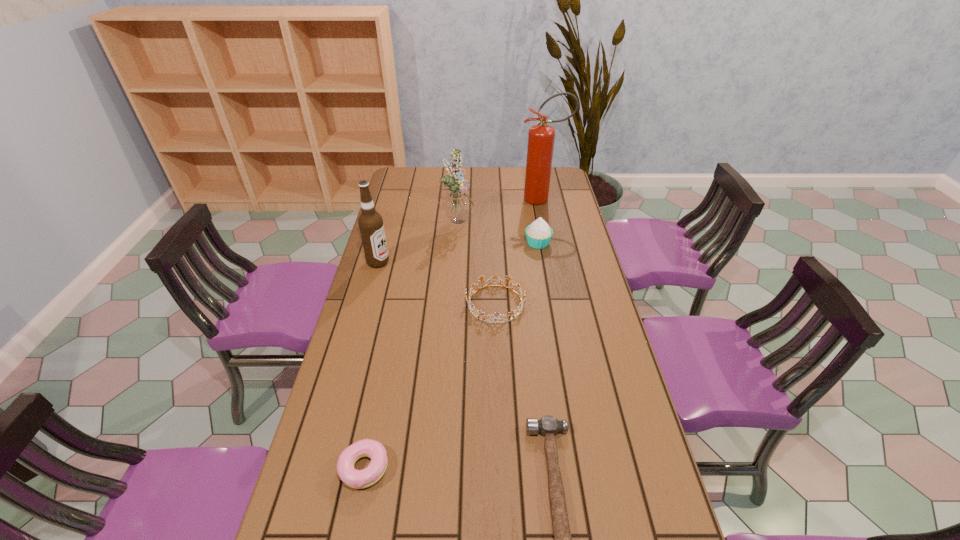
At what (x,y) coordinates should I click in order to perform the action: click on the sixth tallest object. Please return your answer as a coordinate pair (x, y). This screenshot has width=960, height=540. Looking at the image, I should click on click(358, 479).

At what (x,y) coordinates should I click in order to perform the action: click on blank space located from the nozzle of the tallest object. Please return your answer as a coordinate pair (x, y). This screenshot has height=540, width=960. Looking at the image, I should click on (444, 199).

At what (x,y) coordinates should I click in order to perform the action: click on vacant space located from the nozzle of the tallest object. Please return your answer as a coordinate pair (x, y). The width and height of the screenshot is (960, 540). Looking at the image, I should click on (486, 199).

Where is `free point located 0.100m from the nozzle of the tallest object`? The width and height of the screenshot is (960, 540). free point located 0.100m from the nozzle of the tallest object is located at coordinates (497, 199).

Find the location of a particular element. free space located on the label of the fourth nearest object is located at coordinates (411, 262).

I want to click on free space located on the front-facing side of the bouquet, so [528, 220].

Where is `vacant space situated on the left of the third farthest object`? vacant space situated on the left of the third farthest object is located at coordinates (482, 243).

Find the location of `vacant space situated on the front-facing side of the tiara`. vacant space situated on the front-facing side of the tiara is located at coordinates (413, 304).

Locate an element on the screen. vacant space positioned 0.370m on the front-facing side of the tiara is located at coordinates pyautogui.click(x=357, y=304).

The height and width of the screenshot is (540, 960). Find the location of `blank area located 0.060m on the front-facing side of the tiara`. blank area located 0.060m on the front-facing side of the tiara is located at coordinates (448, 304).